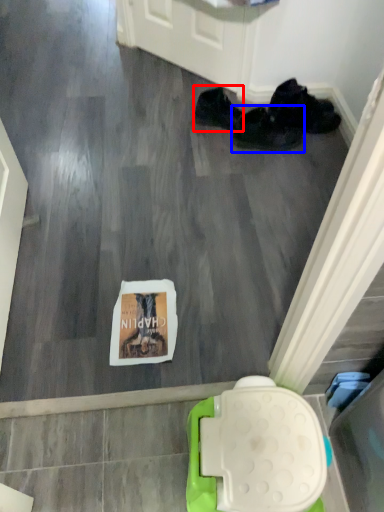
Question: Among these objects, which one is nearest to the camera, footwear (highlighted by a red box) or footwear (highlighted by a blue box)?

Choices:
 (A) footwear
 (B) footwear

Answer: (B)